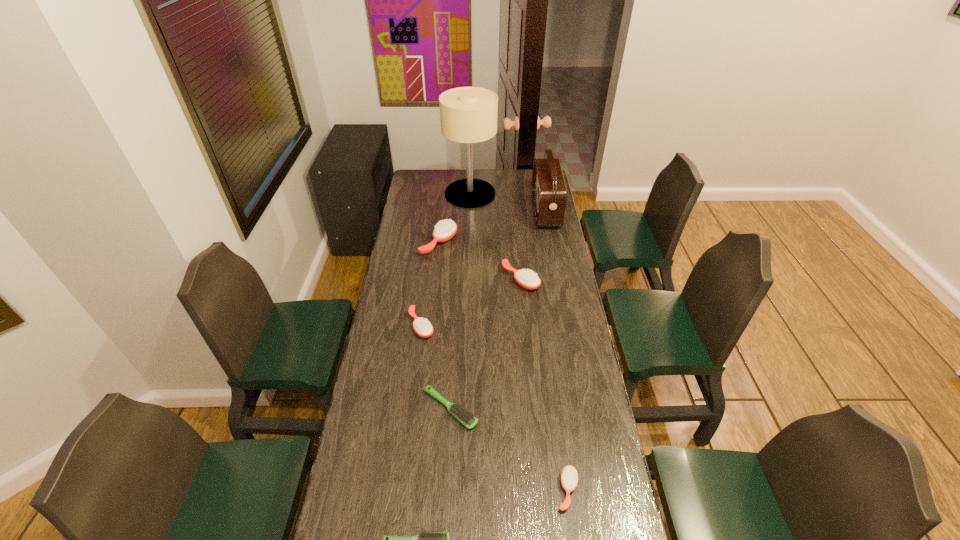
You are a GUI agent. You are given a task and a screenshot of the screen. Output one action in this format:
    pyautogui.click(x=<x>, y=<y>)
    Task: Click on the beige table lamp
    
    Given the screenshot: What is the action you would take?
    pyautogui.click(x=468, y=115)

Locate an element on the screen. Image resolution: width=960 pixels, height=540 pixels. table lamp is located at coordinates (468, 115).

Identify the location of the second tallest object. (549, 193).

You are a GUI agent. You are given a task and a screenshot of the screen. Output one action in this format:
    pyautogui.click(x=<x>, y=<y>)
    Task: Click on the farthest hairbrush
    The height and width of the screenshot is (540, 960).
    Given the screenshot: What is the action you would take?
    pyautogui.click(x=444, y=230)

The height and width of the screenshot is (540, 960). Find the location of `the tallest hairbrush`. the tallest hairbrush is located at coordinates point(444,230).

This screenshot has height=540, width=960. I want to click on the fourth tallest object, so click(x=529, y=280).

Where is `the fourth farthest object`? This screenshot has width=960, height=540. the fourth farthest object is located at coordinates tap(529, 280).

The height and width of the screenshot is (540, 960). Identify the location of the fifth farthest object. (423, 328).

You are a GUI agent. You are given a task and a screenshot of the screen. Output one action in this format:
    pyautogui.click(x=<x>, y=<y>)
    Task: Click on the fifth tallest object
    The width and height of the screenshot is (960, 540).
    Given the screenshot: What is the action you would take?
    pyautogui.click(x=423, y=328)

Locate an element on the screen. The width and height of the screenshot is (960, 540). the third nearest hairbrush is located at coordinates (461, 414).